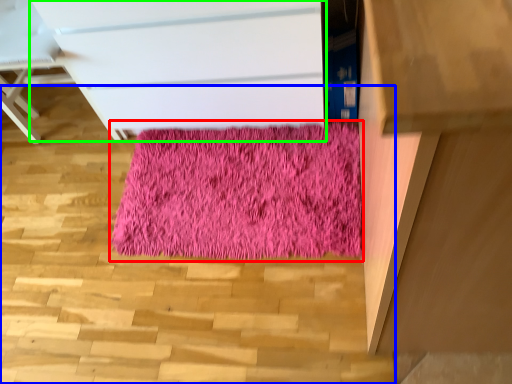
Question: Considering the real-world distances, which object is closest to mat (highlighted by a red box)? stairwell (highlighted by a blue box) or chest of drawers (highlighted by a green box).

Choices:
 (A) stairwell
 (B) chest of drawers

Answer: (A)